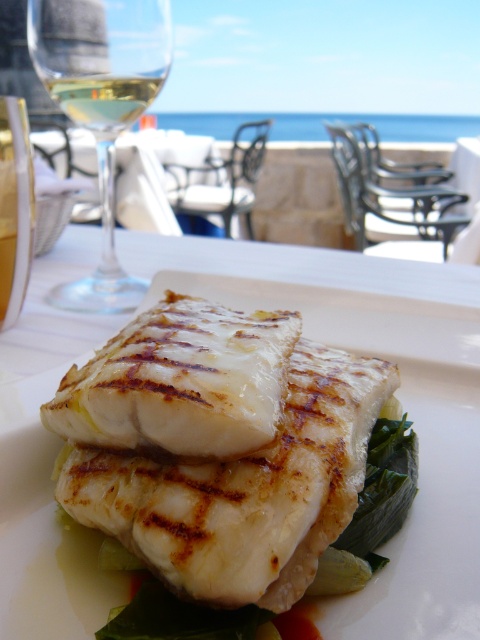
You are a server at a seaside restaurant and need to place a new menu on the table without blocking the view of the grilled fish fillet. The menu will be placed at point with coordinates point (x=444, y=541). Given that the grilled fish fillet is located at a closer distance of 38 centimeters from the viewer, will the menu obstruct the view of the fish?

The distance of point (x=444, y=541) from viewer is 41.53 centimeters, which is farther than the grilled fish fillet at 38 centimeters. Therefore, placing the menu at point (x=444, y=541) will not obstruct the view of the fish since it is behind the fish.

You are a server at a restaurant and need to pour wine into the taller glass. Which glass should you choose between the clear glass wine glass at upper left and the gold metallic wine glass at left?

The clear glass wine glass at upper left is much taller than the gold metallic wine glass at left, so you should choose the clear glass wine glass at upper left to pour the wine into the taller glass.